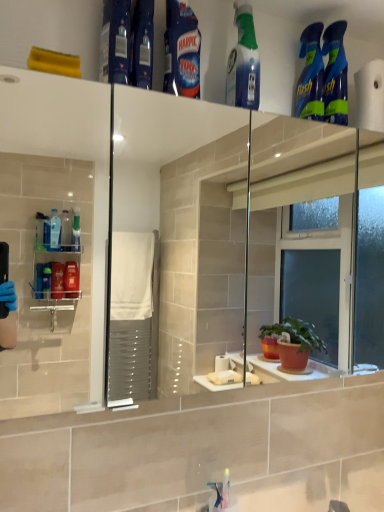
Question: Is blue glossy spray bottles at upper right, which is the 1th cleaning product from right to left, turned away from blue glossy harpic at upper center, marked as the 4th cleaning product in a right-to-left arrangement?

Choices:
 (A) no
 (B) yes

Answer: (A)

Question: Is blue glossy spray bottles at upper right, the fifth cleaning product in the left-to-right sequence, at the left side of blue glossy harpic at upper center, marked as the 4th cleaning product in a right-to-left arrangement?

Choices:
 (A) no
 (B) yes

Answer: (A)

Question: Does blue glossy spray bottles at upper right, which is the 1th cleaning product from right to left, come in front of blue glossy harpic at upper center, which is counted as the 2th cleaning product, starting from the left?

Choices:
 (A) yes
 (B) no

Answer: (B)

Question: Is blue glossy spray bottles at upper right, which is the 1th cleaning product from right to left, completely or partially outside of blue glossy harpic at upper center, which is counted as the 2th cleaning product, starting from the left?

Choices:
 (A) yes
 (B) no

Answer: (A)

Question: Can you confirm if blue glossy spray bottles at upper right, the fifth cleaning product in the left-to-right sequence, is positioned to the right of blue glossy harpic at upper center, which is counted as the 2th cleaning product, starting from the left?

Choices:
 (A) no
 (B) yes

Answer: (B)

Question: From the image's perspective, relative to blue glossy spray bottles at upper right, the fifth cleaning product in the left-to-right sequence, is blue glossy harpic at upper center, which is counted as the 2th cleaning product, starting from the left, above or below?

Choices:
 (A) below
 (B) above

Answer: (B)

Question: Looking at their shapes, would you say blue glossy harpic at upper center, marked as the 4th cleaning product in a right-to-left arrangement, is wider or thinner than blue glossy spray bottles at upper right, the fifth cleaning product in the left-to-right sequence?

Choices:
 (A) thin
 (B) wide

Answer: (A)

Question: Is blue glossy harpic at upper center, marked as the 4th cleaning product in a right-to-left arrangement, bigger or smaller than blue glossy spray bottles at upper right, the fifth cleaning product in the left-to-right sequence?

Choices:
 (A) big
 (B) small

Answer: (B)

Question: Considering the positions of point (188, 94) and point (347, 94), is point (188, 94) closer or farther from the camera than point (347, 94)?

Choices:
 (A) closer
 (B) farther

Answer: (A)

Question: Is blue glossy spray bottles at upper right, which is the 1th cleaning product from right to left, in front of or behind blue plastic bottle at upper center in the image?

Choices:
 (A) behind
 (B) front

Answer: (A)

Question: Looking at their shapes, would you say blue glossy spray bottles at upper right, which is the 1th cleaning product from right to left, is wider or thinner than blue plastic bottle at upper center?

Choices:
 (A) wide
 (B) thin

Answer: (B)

Question: Considering the relative positions of blue glossy spray bottles at upper right, the fifth cleaning product in the left-to-right sequence, and blue plastic bottle at upper center in the image provided, is blue glossy spray bottles at upper right, the fifth cleaning product in the left-to-right sequence, to the left or to the right of blue plastic bottle at upper center?

Choices:
 (A) right
 (B) left

Answer: (A)

Question: Is point [x=337, y=89] positioned closer to the camera than point [x=142, y=58]?

Choices:
 (A) closer
 (B) farther

Answer: (B)

Question: Does point (317, 81) appear closer or farther from the camera than point (105, 33)?

Choices:
 (A) farther
 (B) closer

Answer: (A)

Question: Which is correct: blue glossy spray bottles at upper right, which ranks as the second cleaning product in right-to-left order, is inside blue glossy spray bottle at upper left, positioned as the first cleaning product in left-to-right order, or outside of it?

Choices:
 (A) inside
 (B) outside

Answer: (B)